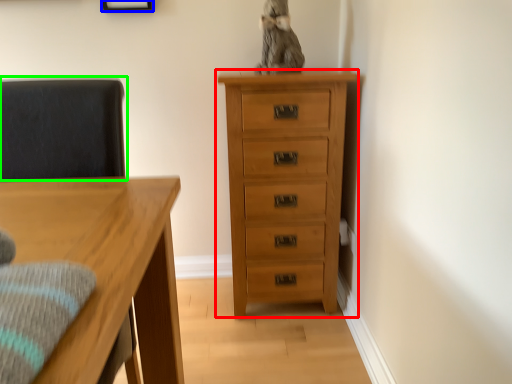
Question: Based on their relative distances, which object is nearer to chest of drawers (highlighted by a red box)? Choose from picture frame (highlighted by a blue box) and swivel chair (highlighted by a green box).

Choices:
 (A) picture frame
 (B) swivel chair

Answer: (B)